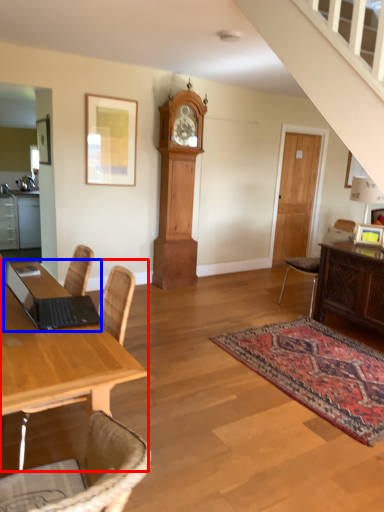
Question: Which point is further to the camera, desk (highlighted by a red box) or laptop (highlighted by a blue box)?

Choices:
 (A) desk
 (B) laptop

Answer: (B)